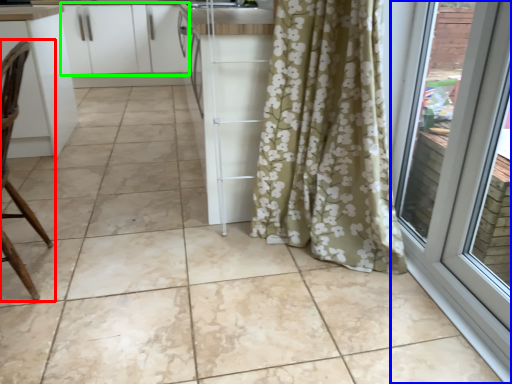
Question: Considering the real-world distances, which object is farthest from chair (highlighted by a red box)? door (highlighted by a blue box) or cabinetry (highlighted by a green box)?

Choices:
 (A) door
 (B) cabinetry

Answer: (B)